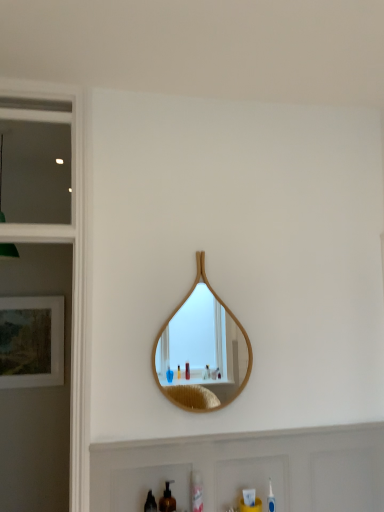
Question: In which direction should I rotate to look at clear plastic mouthwash at lower center, marked as the second mouthwash in a front-to-back arrangement?

Choices:
 (A) right
 (B) left

Answer: (A)

Question: Is white matte cabinet at lower center far from matte wooden picture frame at left?

Choices:
 (A) no
 (B) yes

Answer: (B)

Question: Is white matte cabinet at lower center bigger than matte wooden picture frame at left?

Choices:
 (A) yes
 (B) no

Answer: (A)

Question: Can you confirm if white matte cabinet at lower center is shorter than matte wooden picture frame at left?

Choices:
 (A) no
 (B) yes

Answer: (B)

Question: From the image's perspective, is white matte cabinet at lower center above matte wooden picture frame at left?

Choices:
 (A) yes
 (B) no

Answer: (B)

Question: Is white matte cabinet at lower center positioned with its back to matte wooden picture frame at left?

Choices:
 (A) yes
 (B) no

Answer: (B)

Question: Can you confirm if white matte cabinet at lower center is positioned to the right of matte wooden picture frame at left?

Choices:
 (A) no
 (B) yes

Answer: (B)

Question: Can you confirm if wooden mirror at center is wider than clear plastic mouthwash at lower center, the 1th mouthwash in the right-to-left sequence?

Choices:
 (A) no
 (B) yes

Answer: (A)

Question: Can you see wooden mirror at center touching clear plastic mouthwash at lower center, which is counted as the first mouthwash, starting from the back?

Choices:
 (A) no
 (B) yes

Answer: (A)

Question: From a real-world perspective, is wooden mirror at center on clear plastic mouthwash at lower center, which is counted as the first mouthwash, starting from the back?

Choices:
 (A) yes
 (B) no

Answer: (A)

Question: Does wooden mirror at center have a smaller size compared to clear plastic mouthwash at lower center, marked as the second mouthwash in a front-to-back arrangement?

Choices:
 (A) no
 (B) yes

Answer: (A)

Question: Is wooden mirror at center turned away from clear plastic mouthwash at lower center, placed as the second mouthwash when sorted from left to right?

Choices:
 (A) yes
 (B) no

Answer: (B)

Question: Is clear plastic mouthwash at lower center, marked as the second mouthwash in a front-to-back arrangement, located within wooden mirror at center?

Choices:
 (A) no
 (B) yes

Answer: (A)

Question: From the image's perspective, would you say clear glass window at upper left is positioned over matte wooden picture frame at left?

Choices:
 (A) yes
 (B) no

Answer: (A)